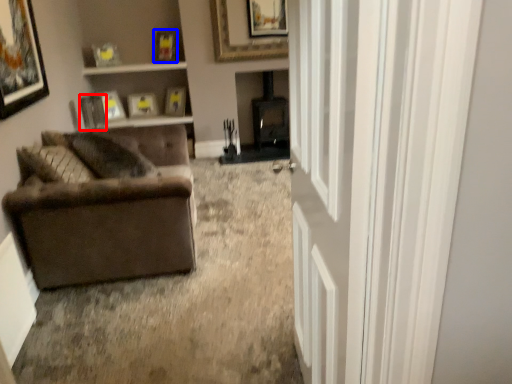
Question: Which of the following is the closest to the observer, picture frame (highlighted by a red box) or picture frame (highlighted by a blue box)?

Choices:
 (A) picture frame
 (B) picture frame

Answer: (A)